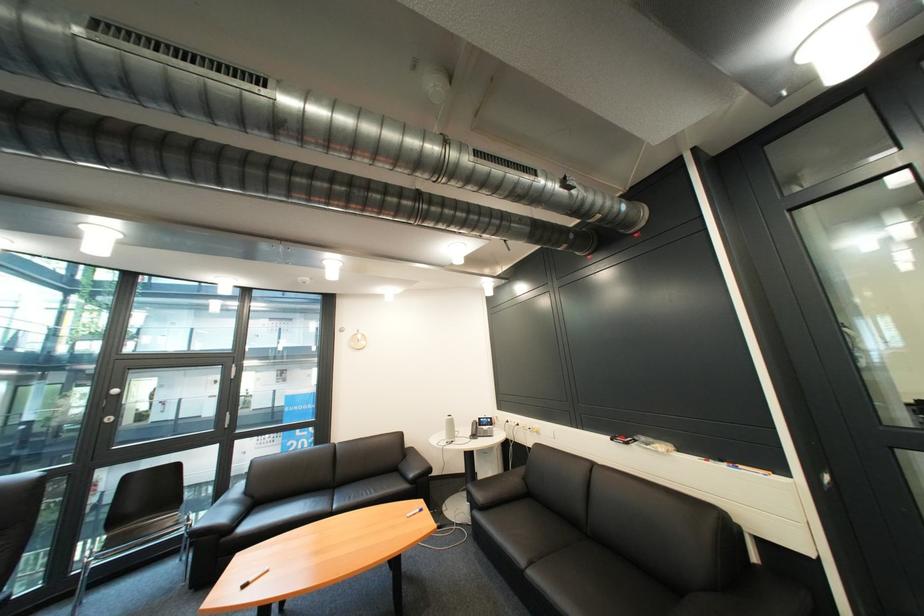
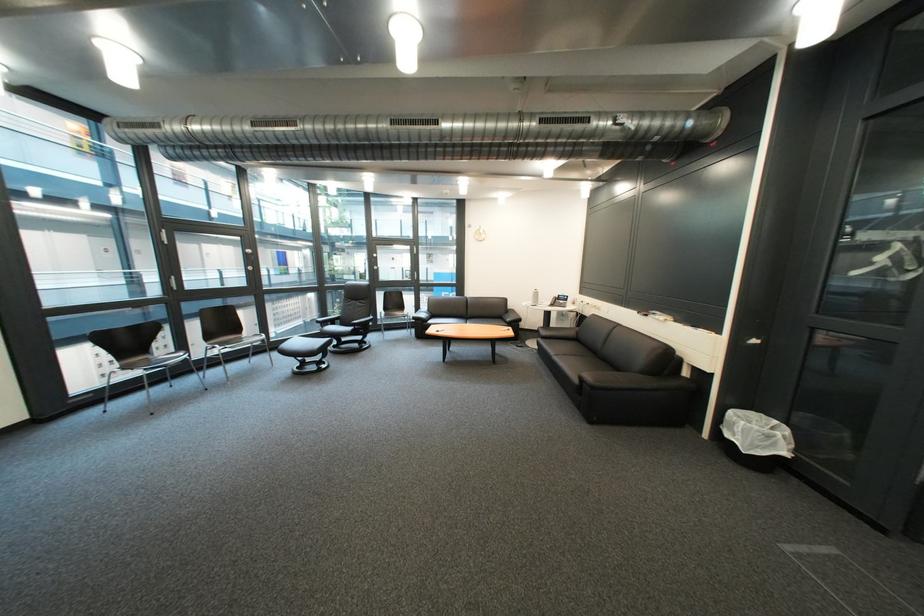
Locate, in the second image, the point that corresponds to [468,438] in the first image.

(552, 305)